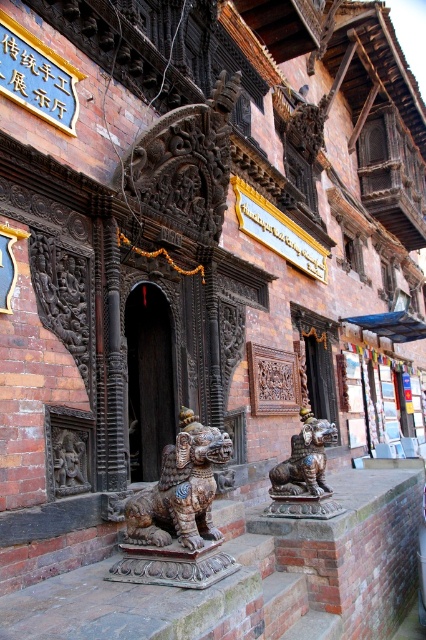
You are an architect examining the traditional structure. The bronze textured lion at center is positioned at coordinates 0.766 on the x and 0.425 on the y. If the entrance is at the center of the facade, is the lion to the left or right of the entrance?

The bronze textured lion at center is located at point (181, 490). Since the entrance is at the center, which would be coordinates around 0.5 on the x and y axes, the lion is to the right of the entrance because its x coordinate is higher than 0.5.